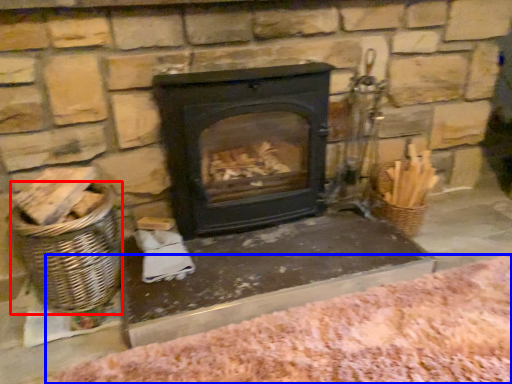
Question: Which of the following is the farthest to the observer, basket (highlighted by a red box) or blanket (highlighted by a blue box)?

Choices:
 (A) basket
 (B) blanket

Answer: (A)